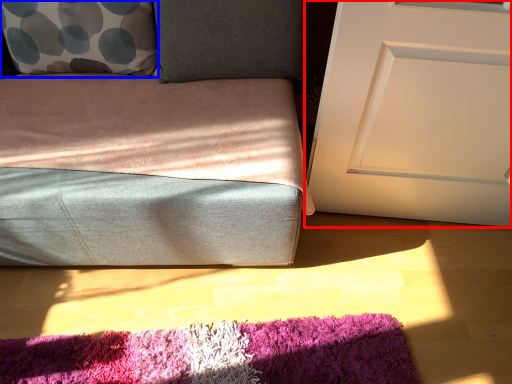
Question: Which object is closer to the camera taking this photo, door (highlighted by a red box) or throw pillow (highlighted by a blue box)?

Choices:
 (A) door
 (B) throw pillow

Answer: (A)